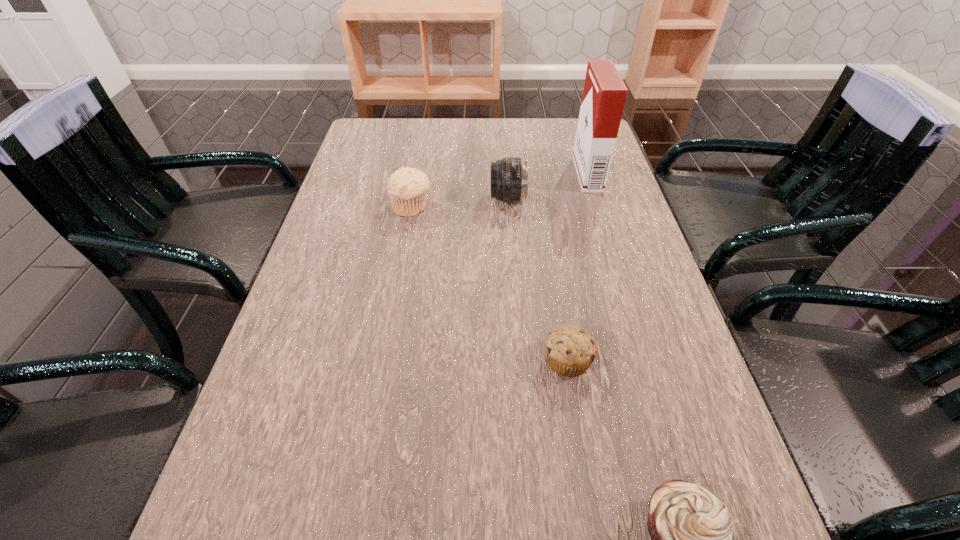
At what (x,y) coordinates should I click in order to perform the action: click on free space located 0.310m at the front element of the telephoto lens. Please return your answer as a coordinate pair (x, y). The width and height of the screenshot is (960, 540). Looking at the image, I should click on (372, 199).

I want to click on free spot located at the front element of the telephoto lens, so click(442, 199).

What are the coordinates of `vacant space situated on the back of the leftmost object` in the screenshot? It's located at (418, 174).

Locate an element on the screen. free space located 0.140m on the back of the second nearest muffin is located at coordinates (556, 286).

Find the location of a particular element. object at the far edge is located at coordinates (604, 94).

Locate an element on the screen. This screenshot has width=960, height=540. object situated at the left edge is located at coordinates (407, 187).

Find the location of a particular element. The image size is (960, 540). object located at the right edge is located at coordinates (604, 94).

Where is `object positioned at the far right corner`? object positioned at the far right corner is located at coordinates (604, 94).

The width and height of the screenshot is (960, 540). What are the coordinates of `vacant space at the far edge` in the screenshot? It's located at (519, 143).

In the image, there is a desktop. At what (x,y) coordinates should I click in order to perform the action: click on vacant space at the left edge. Please return your answer as a coordinate pair (x, y). This screenshot has height=540, width=960. Looking at the image, I should click on (257, 393).